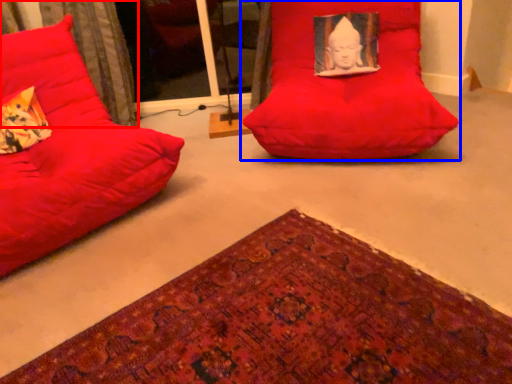
Question: Which object is further to the camera taking this photo, curtain (highlighted by a red box) or furniture (highlighted by a blue box)?

Choices:
 (A) curtain
 (B) furniture

Answer: (A)